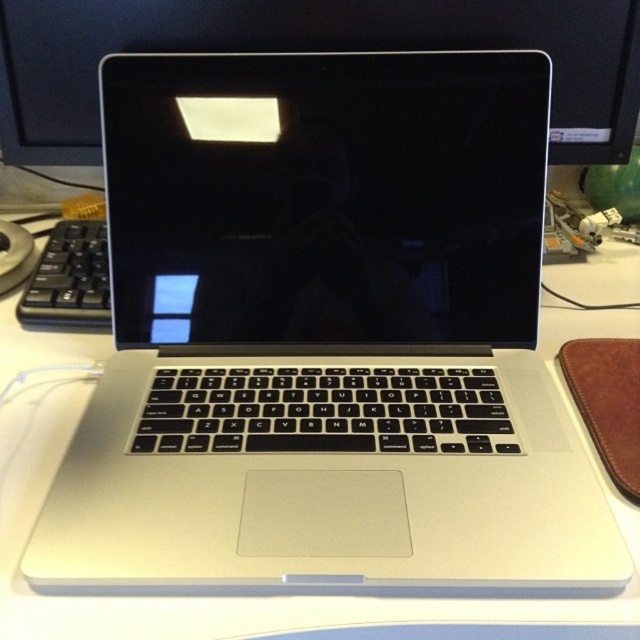
Question: Can you confirm if satin black monitor at center is positioned to the left of black matte keyboard at left?

Choices:
 (A) no
 (B) yes

Answer: (A)

Question: Does satin black monitor at center appear over black matte keyboard at left?

Choices:
 (A) yes
 (B) no

Answer: (A)

Question: Which object appears farthest from the camera in this image?

Choices:
 (A) satin black monitor at center
 (B) black matte keyboard at left

Answer: (B)

Question: Considering the relative positions of satin black monitor at center and black matte keyboard at left in the image provided, where is satin black monitor at center located with respect to black matte keyboard at left?

Choices:
 (A) above
 (B) below

Answer: (A)